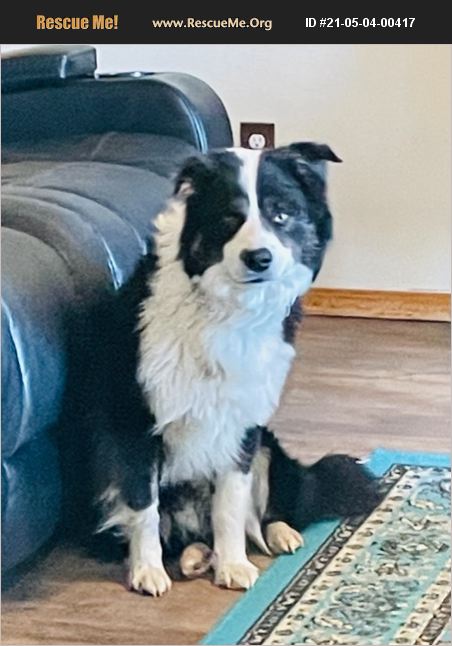
At what (x,y) coordinates should I click in order to perform the action: click on sofa. Please return your answer as a coordinate pair (x, y). The width and height of the screenshot is (452, 646). Looking at the image, I should click on (x=81, y=229).